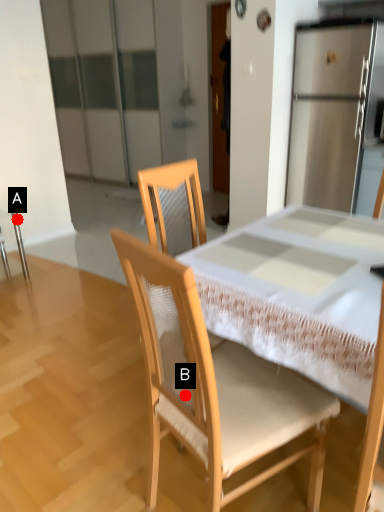
Question: Two points are circled on the image, labeled by A and B beside each circle. Which point appears closest to the camera in this image?

Choices:
 (A) A is closer
 (B) B is closer

Answer: (B)